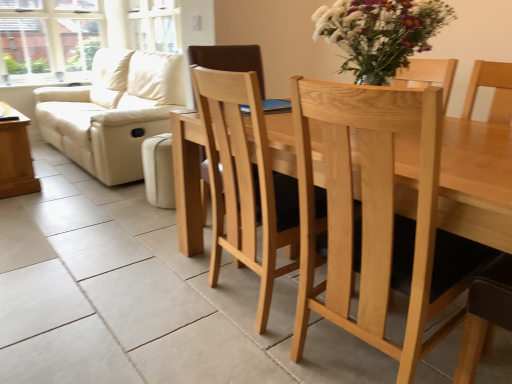
Question: Can you confirm if beige leather couch at left is wider than clear glass window at upper left?

Choices:
 (A) yes
 (B) no

Answer: (A)

Question: Does beige leather couch at left lie behind clear glass window at upper left?

Choices:
 (A) yes
 (B) no

Answer: (B)

Question: Is clear glass window at upper left located within beige leather couch at left?

Choices:
 (A) no
 (B) yes

Answer: (A)

Question: Is beige leather couch at left smaller than clear glass window at upper left?

Choices:
 (A) yes
 (B) no

Answer: (B)

Question: From the image's perspective, does beige leather couch at left appear higher than clear glass window at upper left?

Choices:
 (A) no
 (B) yes

Answer: (A)

Question: Does beige leather couch at left appear on the left side of clear glass window at upper left?

Choices:
 (A) yes
 (B) no

Answer: (B)

Question: From a real-world perspective, is wooden side table at left physically below beige leather couch at left?

Choices:
 (A) no
 (B) yes

Answer: (B)

Question: From the image's perspective, would you say wooden side table at left is shown under beige leather couch at left?

Choices:
 (A) yes
 (B) no

Answer: (A)

Question: Is wooden side table at left located outside beige leather couch at left?

Choices:
 (A) yes
 (B) no

Answer: (A)

Question: Is the position of wooden side table at left more distant than that of beige leather couch at left?

Choices:
 (A) yes
 (B) no

Answer: (A)

Question: From a real-world perspective, is wooden side table at left physically above beige leather couch at left?

Choices:
 (A) yes
 (B) no

Answer: (B)

Question: Is wooden side table at left to the left of beige leather couch at left from the viewer's perspective?

Choices:
 (A) no
 (B) yes

Answer: (B)

Question: Does clear glass window at upper left have a greater height compared to natural wood chair at center?

Choices:
 (A) no
 (B) yes

Answer: (A)